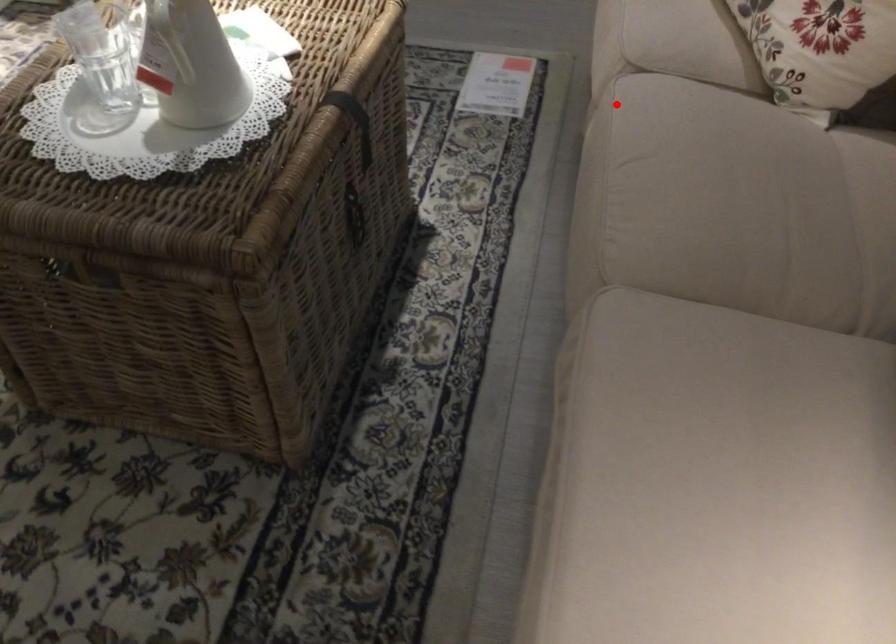
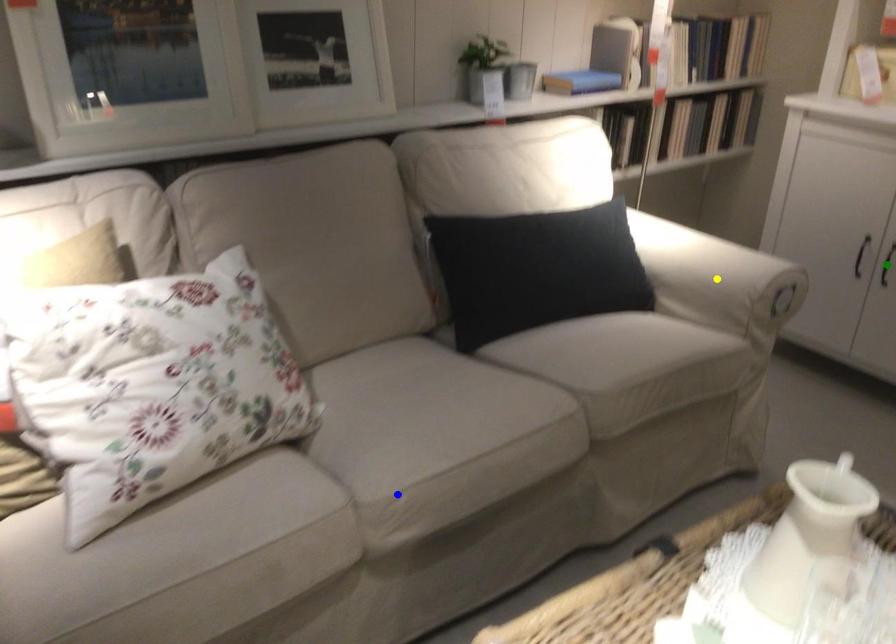
Question: I am providing you with two images of the same scene from different viewpoints. A red point is marked on the first image. You are given multiple points on the second image. Which point in image 2 represents the same 3d spot as the red point in image 1?

Choices:
 (A) yellow point
 (B) green point
 (C) blue point

Answer: (C)